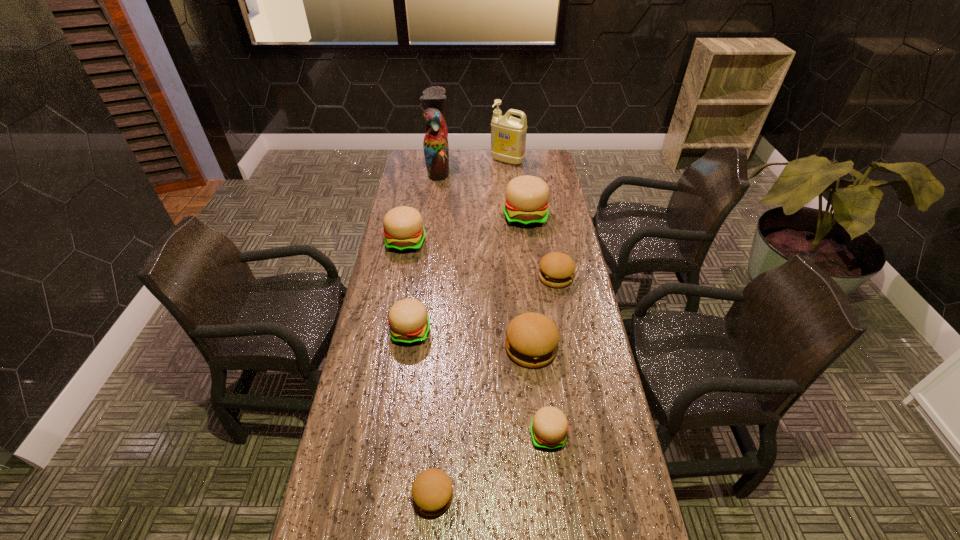
Where is `parrot`? parrot is located at coordinates (436, 149).

Locate an element on the screen. This screenshot has width=960, height=540. beige detergent is located at coordinates (508, 134).

The width and height of the screenshot is (960, 540). Find the location of `the second tallest object`. the second tallest object is located at coordinates (x=508, y=134).

This screenshot has height=540, width=960. I want to click on the tallest hamburger, so click(526, 205).

This screenshot has height=540, width=960. Identify the location of the biggest beige hamburger. pyautogui.click(x=526, y=205).

Identify the location of the sixth shortest hamburger. (403, 226).

I want to click on the third smallest beige hamburger, so click(403, 226).

This screenshot has height=540, width=960. I want to click on the third farthest beige hamburger, so click(409, 324).

Image resolution: width=960 pixels, height=540 pixels. Find the location of `the biggest brown hamburger`. the biggest brown hamburger is located at coordinates (532, 339).

Where is `the farthest brown hamburger`? The height and width of the screenshot is (540, 960). the farthest brown hamburger is located at coordinates (557, 269).